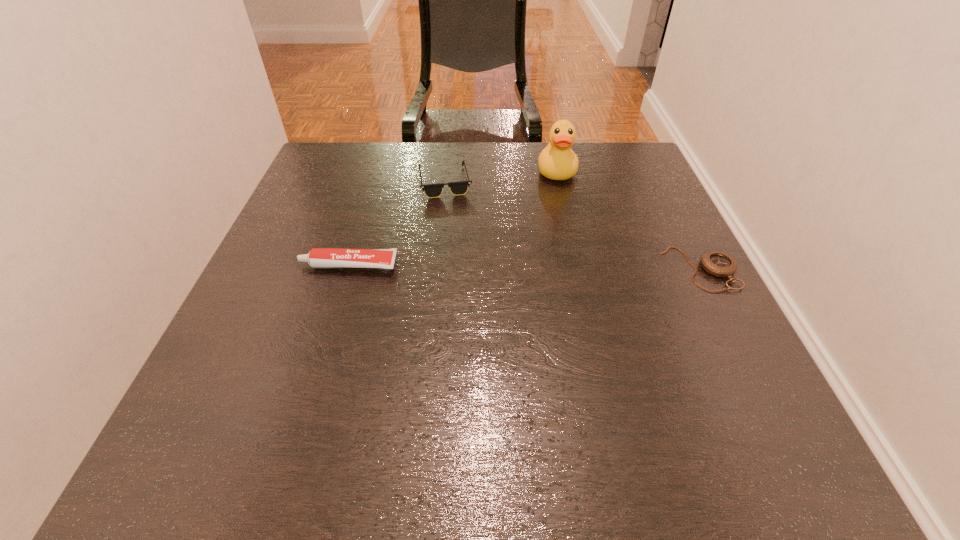
In the image, there is a desktop. At what (x,y) coordinates should I click in order to perform the action: click on free space at the right edge. Please return your answer as a coordinate pair (x, y). This screenshot has width=960, height=540. Looking at the image, I should click on (661, 238).

Locate an element on the screen. free region at the far left corner is located at coordinates 350,167.

This screenshot has width=960, height=540. What are the coordinates of `vacant region at the near left corner of the desktop` in the screenshot? It's located at (304, 369).

In the image, there is a desktop. Identify the location of blank space at the far right corner. tap(645, 158).

Image resolution: width=960 pixels, height=540 pixels. What are the coordinates of `vacant region at the near right corner of the desktop` in the screenshot? It's located at (747, 383).

Locate an element on the screen. The width and height of the screenshot is (960, 540). vacant area between the duck and the sunglasses is located at coordinates (500, 177).

Find the location of a particular element. free space between the duck and the sunglasses is located at coordinates (500, 177).

In order to click on vacant region between the rightmost object and the toothpaste in this screenshot , I will do `click(524, 267)`.

This screenshot has width=960, height=540. Find the location of `vacant space that's between the sunglasses and the third object from left to right`. vacant space that's between the sunglasses and the third object from left to right is located at coordinates tap(500, 177).

What are the coordinates of `free space between the second object from left to right and the leftmost object` in the screenshot? It's located at (396, 224).